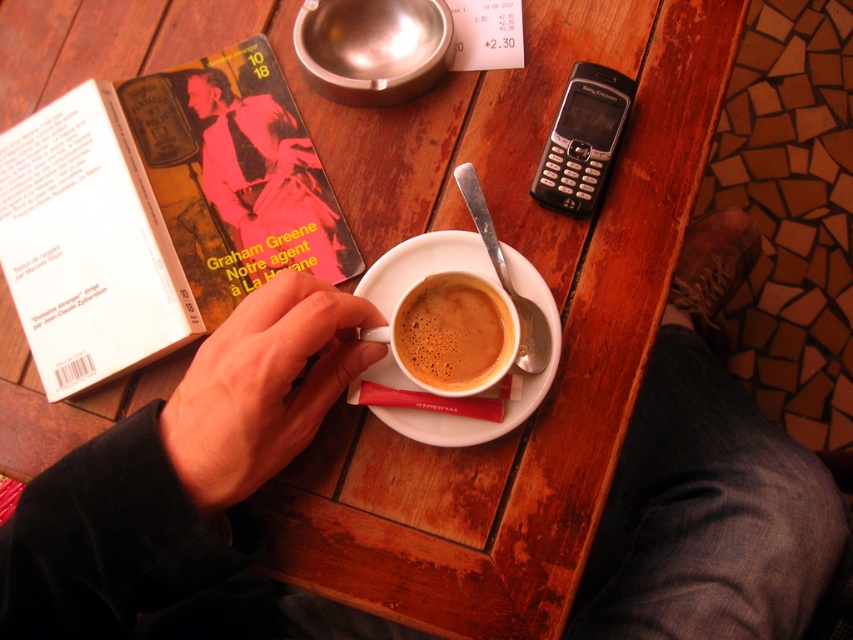
Question: Does hardcover book at upper left appear on the right side of white ceramic saucer at center?

Choices:
 (A) no
 (B) yes

Answer: (A)

Question: From the image, what is the correct spatial relationship of white ceramic saucer at center in relation to matte ceramic cup at center?

Choices:
 (A) left
 (B) right

Answer: (B)

Question: Considering the real-world distances, which object is closest to the pink paper book at upper left?

Choices:
 (A) hardcover book at upper left
 (B) smooth skin hand at center
 (C) white ceramic saucer at center
 (D) matte ceramic cup at center

Answer: (A)

Question: Which of the following is the farthest from the observer?

Choices:
 (A) (451, 314)
 (B) (277, 200)

Answer: (B)

Question: Which object appears farthest from the camera in this image?

Choices:
 (A) silver metallic phone at upper right
 (B) pink paper book at upper left
 (C) white ceramic saucer at center

Answer: (B)

Question: Does hardcover book at upper left appear on the left side of smooth skin hand at center?

Choices:
 (A) yes
 (B) no

Answer: (A)